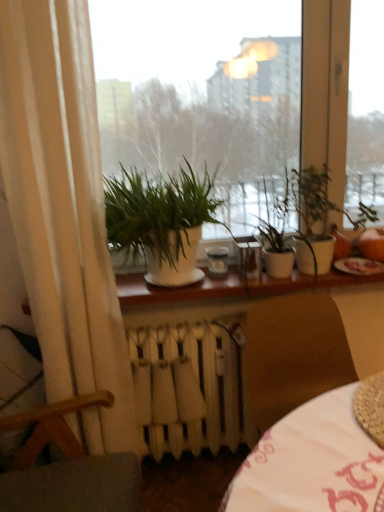
Describe the element at coordinates (63, 212) in the screenshot. Image resolution: width=384 pixels, height=512 pixels. I see `white fabric curtain at left` at that location.

I want to click on white glossy window sill at center, so click(230, 287).

From the picture: What is the approximate width of white glossy window sill at center?

11.64 inches.

Measure the distance between point [259,490] and camera.

They are 30.04 inches apart.

Image resolution: width=384 pixels, height=512 pixels. What do you see at coordinates (312, 463) in the screenshot? I see `white fabric table at lower right` at bounding box center [312, 463].

Measure the distance between white glossy window at center and camera.

1.33 meters.

This screenshot has width=384, height=512. What do you see at coordinates (315, 205) in the screenshot?
I see `green matte plant at center, which ranks as the 2th houseplant in left-to-right order` at bounding box center [315, 205].

How much space does green matte plant at center, the first houseplant in the left-to-right sequence, occupy horizontally?

green matte plant at center, the first houseplant in the left-to-right sequence, is 16.94 inches wide.

This screenshot has width=384, height=512. I want to click on wooden armchair at lower left, so click(67, 466).

Measure the distance between point [223,408] and camera.

The depth of point [223,408] is 1.84 meters.

Where is `white fabric curtain at left`? The height and width of the screenshot is (512, 384). white fabric curtain at left is located at coordinates (63, 212).

Which is behind, point (342, 285) or point (342, 464)?

The point (342, 285) is more distant.

Does white glossy window sill at center turn towards white fabric table at lower right?

No, white glossy window sill at center is not facing towards white fabric table at lower right.

Does white glossy window sill at center lie in front of white fabric table at lower right?

No, white glossy window sill at center is further to the viewer.

Based on the photo, is white glossy window sill at center thinner than wooden armchair at lower left?

Yes, white glossy window sill at center is thinner than wooden armchair at lower left.

How many degrees apart are the facing directions of white glossy window sill at center and wooden armchair at lower left?

They differ by 91 degrees in their facing directions.

Does white glossy window sill at center turn towards wooden armchair at lower left?

No, white glossy window sill at center is not aimed at wooden armchair at lower left.

Measure the distance between green matte plant at center, which ranks as the 2th houseplant in left-to-right order, and white fabric curtain at left.

green matte plant at center, which ranks as the 2th houseplant in left-to-right order, and white fabric curtain at left are 33.99 inches apart from each other.

Is point (322, 196) in front of point (124, 387)?

No, (322, 196) is further to viewer.

Considering the sizes of objects green matte plant at center, which is the first houseplant from right to left, and white fabric curtain at left in the image provided, who is thinner, green matte plant at center, which is the first houseplant from right to left, or white fabric curtain at left?

white fabric curtain at left.

From the picture: Considering the sizes of wooden armchair at lower left and white metallic radiator at lower center in the image, is wooden armchair at lower left wider or thinner than white metallic radiator at lower center?

wooden armchair at lower left is wider than white metallic radiator at lower center.

Looking at this image, considering the sizes of wooden armchair at lower left and white metallic radiator at lower center in the image, is wooden armchair at lower left taller or shorter than white metallic radiator at lower center?

Clearly, wooden armchair at lower left is taller compared to white metallic radiator at lower center.

From a real-world perspective, does wooden armchair at lower left sit lower than white metallic radiator at lower center?

No, from a real-world perspective, wooden armchair at lower left is not under white metallic radiator at lower center.

Which is in front, point (319, 181) or point (315, 413)?

The point (315, 413) is closer to the camera.

In terms of width, does green matte plant at center, which is the first houseplant from right to left, look wider or thinner when compared to white fabric table at lower right?

Clearly, green matte plant at center, which is the first houseplant from right to left, has less width compared to white fabric table at lower right.

Who is smaller, green matte plant at center, which ranks as the 2th houseplant in left-to-right order, or white fabric table at lower right?

green matte plant at center, which ranks as the 2th houseplant in left-to-right order, is smaller.

Does green matte plant at center, which ranks as the 2th houseplant in left-to-right order, have a greater width compared to green matte plant at center, the first houseplant in the left-to-right sequence?

In fact, green matte plant at center, which ranks as the 2th houseplant in left-to-right order, might be narrower than green matte plant at center, the first houseplant in the left-to-right sequence.

Based on the photo, which object is further away from the camera taking this photo, green matte plant at center, which is the first houseplant from right to left, or green matte plant at center, which appears as the 2th houseplant when viewed from the right?

green matte plant at center, which is the first houseplant from right to left, is more distant.

Is green matte plant at center, which appears as the 2th houseplant when viewed from the right, at the back of green matte plant at center, which ranks as the 2th houseplant in left-to-right order?

No, green matte plant at center, which ranks as the 2th houseplant in left-to-right order, is not facing the opposite direction of green matte plant at center, which appears as the 2th houseplant when viewed from the right.

Looking at this image, how many degrees apart are the facing directions of green matte plant at center, which is the first houseplant from right to left, and green matte plant at center, the first houseplant in the left-to-right sequence?

4.28e-05 degrees.

Which of these two, white glossy window at center or green matte plant at center, which is the first houseplant from right to left, stands taller?

With more height is white glossy window at center.

Between point (245, 229) and point (369, 213), which one is positioned behind?

The point (369, 213) is farther from the camera.

Could you tell me if white glossy window at center is turned towards green matte plant at center, which ranks as the 2th houseplant in left-to-right order?

Yes, white glossy window at center is facing green matte plant at center, which ranks as the 2th houseplant in left-to-right order.

The image size is (384, 512). Identify the location of window sill on the left of white fabric table at lower right. (230, 287).

Identify the location of window sill above the wooden armchair at lower left (from the image's perspective). The image size is (384, 512). (230, 287).

From the image, which object appears to be farther from green matte plant at center, the first houseplant in the left-to-right sequence, white fabric table at lower right or white glossy window sill at center?

The object further to green matte plant at center, the first houseplant in the left-to-right sequence, is white fabric table at lower right.

When comparing their distances from white fabric curtain at left, does green matte plant at center, the first houseplant in the left-to-right sequence, or white fabric table at lower right seem closer?

green matte plant at center, the first houseplant in the left-to-right sequence, lies closer to white fabric curtain at left than the other object.

From the image, which object appears to be nearer to white glossy window sill at center, white metallic radiator at lower center or green matte plant at center, which ranks as the 2th houseplant in left-to-right order?

green matte plant at center, which ranks as the 2th houseplant in left-to-right order, lies closer to white glossy window sill at center than the other object.

Based on their spatial positions, is white glossy window sill at center or white metallic radiator at lower center closer to white glossy window at center?

Based on the image, white glossy window sill at center appears to be nearer to white glossy window at center.

Estimate the real-world distances between objects in this image. Which object is further from white glossy window sill at center, wooden armchair at lower left or white glossy window at center?

Among the two, wooden armchair at lower left is located further to white glossy window sill at center.

When comparing their distances from green matte plant at center, which appears as the 2th houseplant when viewed from the right, does white metallic radiator at lower center or white glossy window sill at center seem closer?

The object closer to green matte plant at center, which appears as the 2th houseplant when viewed from the right, is white glossy window sill at center.

Estimate the real-world distances between objects in this image. Which object is closer to white glossy window at center, white glossy window sill at center or white fabric table at lower right?

white glossy window sill at center is positioned closer to the anchor white glossy window at center.

Which object lies further to the anchor point white metallic radiator at lower center, white fabric table at lower right or white glossy window sill at center?

Based on the image, white fabric table at lower right appears to be further to white metallic radiator at lower center.

The width and height of the screenshot is (384, 512). Identify the location of table between white glossy window at center and wooden armchair at lower left from top to bottom. (312, 463).

You are a GUI agent. You are given a task and a screenshot of the screen. Output one action in this format:
    pyautogui.click(x=<x>, y=<y>)
    Task: Click on the curtain between white glossy window at center and wooden armchair at lower left in the up-down direction
    The image size is (384, 512).
    Given the screenshot: What is the action you would take?
    pyautogui.click(x=63, y=212)

Find the location of `window sill that lies between green matte plant at center, the first houseplant in the left-to-right sequence, and white fabric table at lower right from top to bottom`. window sill that lies between green matte plant at center, the first houseplant in the left-to-right sequence, and white fabric table at lower right from top to bottom is located at coordinates (230, 287).

This screenshot has width=384, height=512. Find the location of `window sill located between green matte plant at center, the first houseplant in the left-to-right sequence, and green matte plant at center, which ranks as the 2th houseplant in left-to-right order, in the left-right direction`. window sill located between green matte plant at center, the first houseplant in the left-to-right sequence, and green matte plant at center, which ranks as the 2th houseplant in left-to-right order, in the left-right direction is located at coordinates (230, 287).